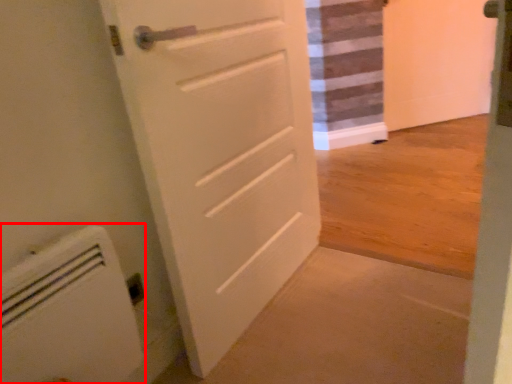
Question: Where is appliance (annotated by the red box) located in relation to door in the image?

Choices:
 (A) left
 (B) right

Answer: (A)